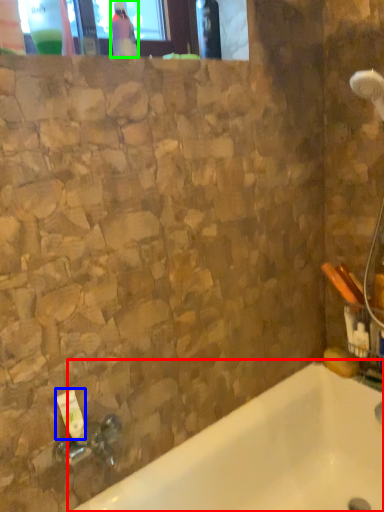
Question: Which object is the closest to the bathtub (highlighted by a red box)? Choose among these: toiletry (highlighted by a blue box) or bottle (highlighted by a green box).

Choices:
 (A) toiletry
 (B) bottle

Answer: (A)